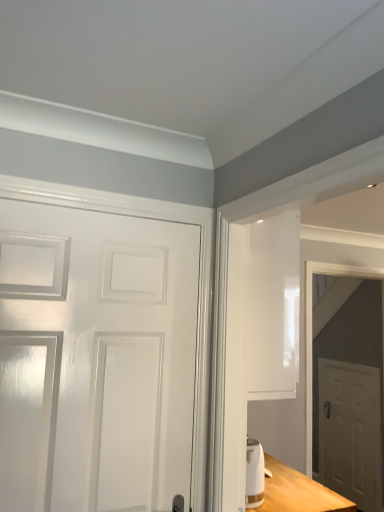
Measure the distance between white matte door at right, the second door positioned from the left, and camera.

The distance of white matte door at right, the second door positioned from the left, from camera is 3.46 meters.

The width and height of the screenshot is (384, 512). I want to click on white matte door at right, which is the first door from right to left, so click(x=350, y=432).

Where is `door above the white matte door at right, the second door positioned from the left (from a real-world perspective)`? door above the white matte door at right, the second door positioned from the left (from a real-world perspective) is located at coordinates 95,358.

Does white glossy door at left, which is the second door in bottom-to-top order, come in front of white matte door at right, which is the first door from right to left?

Yes, it is in front of white matte door at right, which is the first door from right to left.

Does white matte door at right, which is the 1th door in back-to-front order, have a greater width compared to white glossy door at left, the 1th door viewed from the top?

No.

Is white matte door at right, the 2th door positioned from the front, bigger or smaller than white glossy door at left, positioned as the 2th door in right-to-left order?

Considering their sizes, white matte door at right, the 2th door positioned from the front, takes up less space than white glossy door at left, positioned as the 2th door in right-to-left order.

How much distance is there between white matte door at right, which is the 1th door in back-to-front order, and white glossy door at left, acting as the 1th door starting from the front?

They are 9.50 feet apart.

From a real-world perspective, relative to white glossy door at left, the 1th door viewed from the top, is white matte door at right, which is the 1th door in back-to-front order, vertically above or below?

white matte door at right, which is the 1th door in back-to-front order, is situated lower than white glossy door at left, the 1th door viewed from the top, in the real world.

Does white glossy door at right have a greater width compared to white glossy door at left, the 1th door viewed from the top?

Correct, the width of white glossy door at right exceeds that of white glossy door at left, the 1th door viewed from the top.

Is white glossy door at right oriented away from white glossy door at left, placed as the 1th door when sorted from left to right?

white glossy door at right is not turned away from white glossy door at left, placed as the 1th door when sorted from left to right.

Consider the image. Can you tell me how much white glossy door at right and white glossy door at left, positioned as the 2th door in right-to-left order, differ in facing direction?

white glossy door at right and white glossy door at left, positioned as the 2th door in right-to-left order, are facing 2.35 degrees away from each other.

The width and height of the screenshot is (384, 512). In order to click on door that is above the white glossy door at right (from a real-world perspective) in this screenshot , I will do `click(95, 358)`.

Which is less distant, (345, 272) or (326, 426)?

The point (345, 272) is more forward.

Consider the image. Would you say white glossy door at right is inside or outside white matte door at right, arranged as the 1th door when ordered from the bottom?

white glossy door at right exists outside the volume of white matte door at right, arranged as the 1th door when ordered from the bottom.

Which object is closer to the camera taking this photo, white glossy door at right or white matte door at right, arranged as the 1th door when ordered from the bottom?

Positioned in front is white glossy door at right.

From the image's perspective, is white glossy door at right above white matte door at right, the 2th door positioned from the front?

Yes, from the image's perspective, white glossy door at right is above white matte door at right, the 2th door positioned from the front.

Between white glossy door at left, which is the second door in bottom-to-top order, and white glossy door at right, which one has smaller width?

With smaller width is white glossy door at left, which is the second door in bottom-to-top order.

Considering the positions of point (50, 238) and point (308, 298), is point (50, 238) closer or farther from the camera than point (308, 298)?

Point (50, 238) is closer to the camera than point (308, 298).

Which is more to the right, white glossy door at left, the 1th door viewed from the top, or white glossy door at right?

white glossy door at right is more to the right.

Are white matte door at right, which is the 1th door in back-to-front order, and white glossy door at right located far from each other?

No, white matte door at right, which is the 1th door in back-to-front order, is in close proximity to white glossy door at right.

Between white matte door at right, which is the 1th door in back-to-front order, and white glossy door at right, which one is positioned behind?

white matte door at right, which is the 1th door in back-to-front order, is more distant.

From a real-world perspective, which object stands above the other?

white glossy door at right, from a real-world perspective.

Looking at this image, from the image's perspective, which is above, white matte door at right, which is the 1th door in back-to-front order, or white glossy door at right?

From the image's view, white glossy door at right is above.

Identify the location of door below the white glossy door at left, positioned as the 2th door in right-to-left order (from a real-world perspective). This screenshot has height=512, width=384. (350, 432).

You are a GUI agent. You are given a task and a screenshot of the screen. Output one action in this format:
    pyautogui.click(x=<x>, y=<y>)
    Task: Click on the door to the right of white glossy door at left, placed as the 1th door when sorted from left to right
    Image resolution: width=384 pixels, height=512 pixels.
    Given the screenshot: What is the action you would take?
    tap(350, 432)

From the image, which object appears to be farther from white matte door at right, which is the 1th door in back-to-front order, white glossy door at right or white glossy door at left, placed as the 1th door when sorted from left to right?

white glossy door at left, placed as the 1th door when sorted from left to right.

Based on their spatial positions, is white glossy door at right or white matte door at right, which is the 1th door in back-to-front order, further from white glossy door at left, placed as the 1th door when sorted from left to right?

white glossy door at right.

Considering their positions, is white glossy door at left, positioned as the 2th door in right-to-left order, positioned closer to white glossy door at right than white matte door at right, which is the first door from right to left?

white matte door at right, which is the first door from right to left, is closer to white glossy door at right.

Looking at this image, from the image, which object appears to be farther from white matte door at right, which is the 1th door in back-to-front order, white glossy door at left, the 1th door viewed from the top, or white glossy door at right?

The object further to white matte door at right, which is the 1th door in back-to-front order, is white glossy door at left, the 1th door viewed from the top.

When comparing their distances from white glossy door at right, does white matte door at right, which is the first door from right to left, or white glossy door at left, the 1th door viewed from the top, seem closer?

The object closer to white glossy door at right is white matte door at right, which is the first door from right to left.

Considering their positions, is white matte door at right, which is the first door from right to left, positioned closer to white glossy door at left, acting as the 1th door starting from the front, than white glossy door at right?

white matte door at right, which is the first door from right to left, lies closer to white glossy door at left, acting as the 1th door starting from the front, than the other object.

What are the coordinates of `elevator between white glossy door at left, acting as the 1th door starting from the front, and white matte door at right, which is the first door from right to left, in the front-back direction` in the screenshot? It's located at (312, 330).